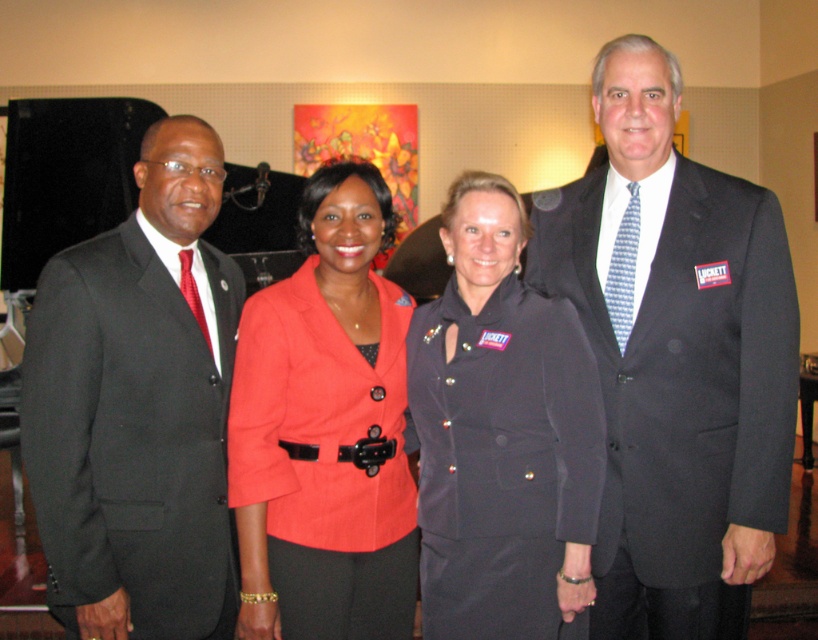
Between matte black suit at left and matte black blazer at center, which one is positioned higher?

matte black suit at left is above.

Can you confirm if matte black suit at left is positioned above matte black blazer at center?

Yes, matte black suit at left is above matte black blazer at center.

Is point (192, 157) behind point (490, 244)?

That is True.

At what (x,y) coordinates should I click in order to perform the action: click on matte black suit at left. Please return your answer as a coordinate pair (x, y). Image resolution: width=818 pixels, height=640 pixels. Looking at the image, I should click on (138, 406).

Which is more to the left, dark gray suit at center or matte black blazer at center?

matte black blazer at center

Between dark gray suit at center and matte black blazer at center, which one appears on the right side from the viewer's perspective?

dark gray suit at center is more to the right.

What do you see at coordinates (675, 356) in the screenshot?
I see `dark gray suit at center` at bounding box center [675, 356].

The width and height of the screenshot is (818, 640). Find the location of `dark gray suit at center`. dark gray suit at center is located at coordinates (675, 356).

Is matte red blazer at center to the left of matte black blazer at center from the viewer's perspective?

Yes, matte red blazer at center is to the left of matte black blazer at center.

Does matte red blazer at center have a greater width compared to matte black blazer at center?

Yes.

This screenshot has height=640, width=818. I want to click on matte red blazer at center, so pos(326,429).